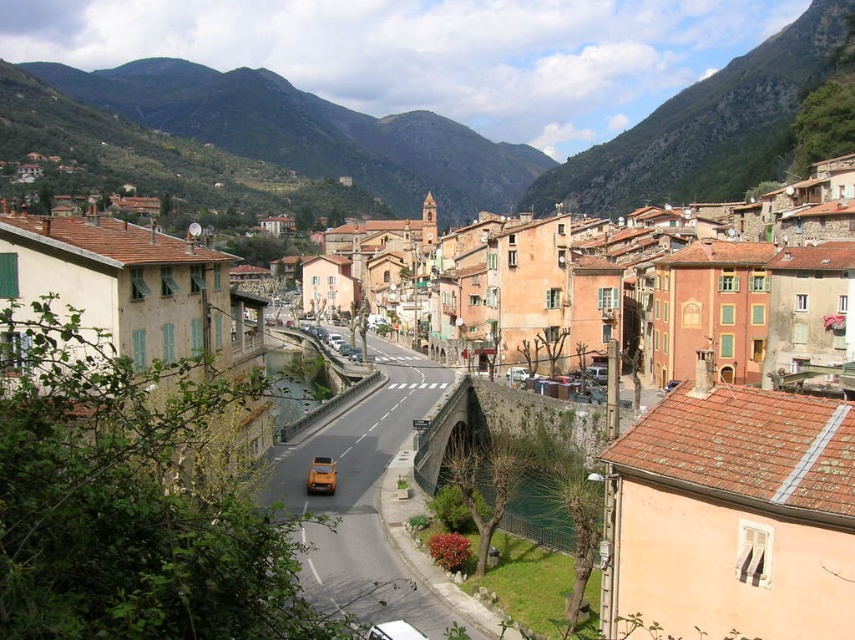
Question: Does green leafy hillside at upper center appear on the right side of metallic gold car at center?

Choices:
 (A) no
 (B) yes

Answer: (A)

Question: From the image, what is the correct spatial relationship of green leafy hillside at upper center in relation to metallic gold car at center?

Choices:
 (A) above
 (B) below

Answer: (A)

Question: Which point appears farthest from the camera in this image?

Choices:
 (A) (531, 179)
 (B) (588, 189)

Answer: (A)

Question: Is green leafy hillside at upper center thinner than metallic gold car at center?

Choices:
 (A) no
 (B) yes

Answer: (A)

Question: Which point appears closest to the camera in this image?

Choices:
 (A) (532, 208)
 (B) (311, 477)

Answer: (B)

Question: Which of these objects is positioned closest to the metallic gold car at center?

Choices:
 (A) green leafy hillside at upper center
 (B) green stone hillside at upper center

Answer: (B)